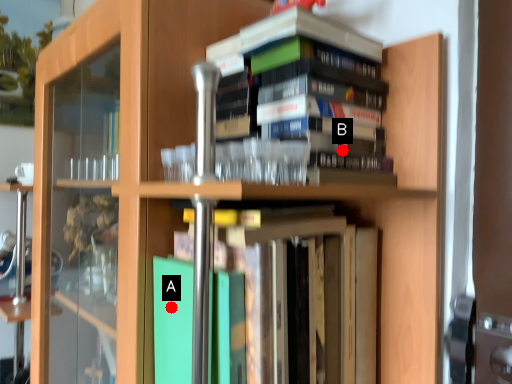
Question: Two points are circled on the image, labeled by A and B beside each circle. Which point appears closest to the camera in this image?

Choices:
 (A) A is closer
 (B) B is closer

Answer: (B)